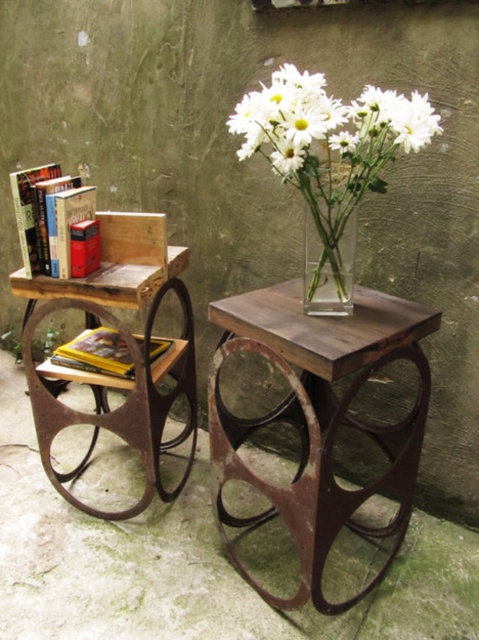
Question: Which object is farther from the camera taking this photo?

Choices:
 (A) yellow matte book at lower left
 (B) white glass vase at upper center

Answer: (A)

Question: Is white matte vase at upper center in front of yellow matte book at lower left?

Choices:
 (A) yes
 (B) no

Answer: (A)

Question: From the image, what is the correct spatial relationship of wooden table at center in relation to yellow matte book at lower left?

Choices:
 (A) above
 (B) below

Answer: (B)

Question: Which object is the closest to the yellow matte book at lower left?

Choices:
 (A) hardcover book at left
 (B) white glass vase at upper center
 (C) white matte vase at upper center

Answer: (A)

Question: Is wooden table at center thinner than wooden table at left?

Choices:
 (A) no
 (B) yes

Answer: (A)

Question: Estimate the real-world distances between objects in this image. Which object is farther from the yellow matte book at lower left?

Choices:
 (A) white glass vase at upper center
 (B) clear glass vase at center
 (C) white matte vase at upper center
 (D) wooden table at center

Answer: (C)